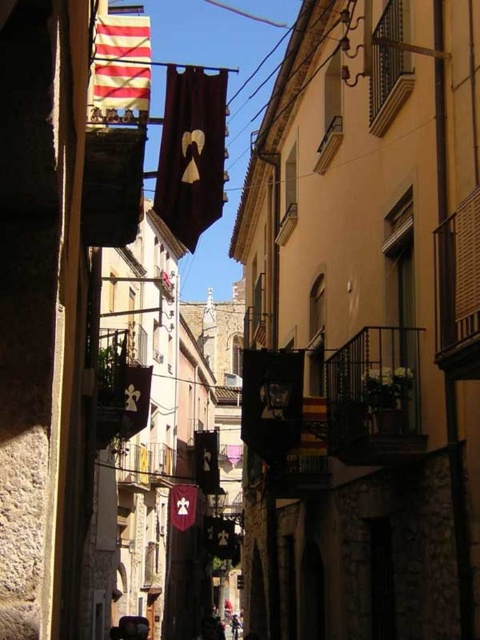
You are a window cleaner standing at the edge of the street. You need to clean both the dark brown fabric flag at center and the maroon velvet flag at center. Which flag should you start with to avoid having to move your ladder more than necessary?

You should start with the dark brown fabric flag at center because it is taller than the maroon velvet flag at center, so you can reach the lower one without moving the ladder.

Based on the photo, you are standing at the camera position looking at the historic street. There are two points marked in the scene, one at coordinates point [147,93] and the other at point [193,493]. Which of these two points is nearer to your current position?

Point [147,93] is closer to the camera than point [193,493], so the point at coordinates point [147,93] is nearer to your current position.